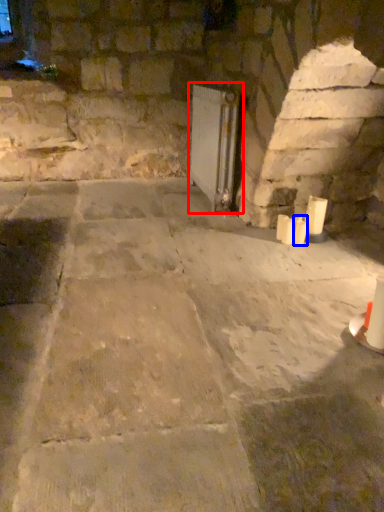
Question: Which object appears closest to the camera in this image, fireplace (highlighted by a red box) or candle (highlighted by a blue box)?

Choices:
 (A) fireplace
 (B) candle

Answer: (B)